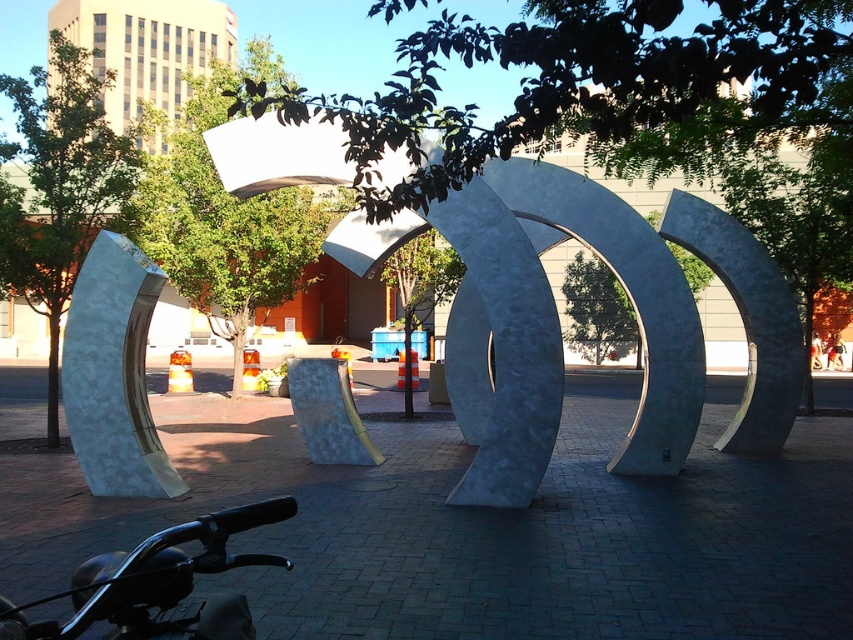
You are standing next to the black matte motorcycle handlebars at lower left and want to take a photo of the metallic silver sculpture at center. If your camera has a focal length of 50mm, which is suitable for subjects between 10 to 20 feet away, will this setting work?

The metallic silver sculpture at center is 17.50 feet away from the black matte motorcycle handlebars at lower left. Since your camera has a focal length of 50mm, which works for subjects between 10 to 20 feet away, the setting is suitable for capturing the metallic silver sculpture at center.

You are a delivery person who needs to pass between the metallic silver sculpture at center and the black matte motorcycle handlebars at lower left. Can you fit through the space between them based on their thickness?

The metallic silver sculpture at center is thinner than the black matte motorcycle handlebars at lower left, so the space between them may be narrow. However, since the sculpture is thinner, it might allow enough space for you to pass through if the distance between them is sufficient. Without knowing the exact distance between the two objects, it is difficult to determine if the space is wide enough for passage.